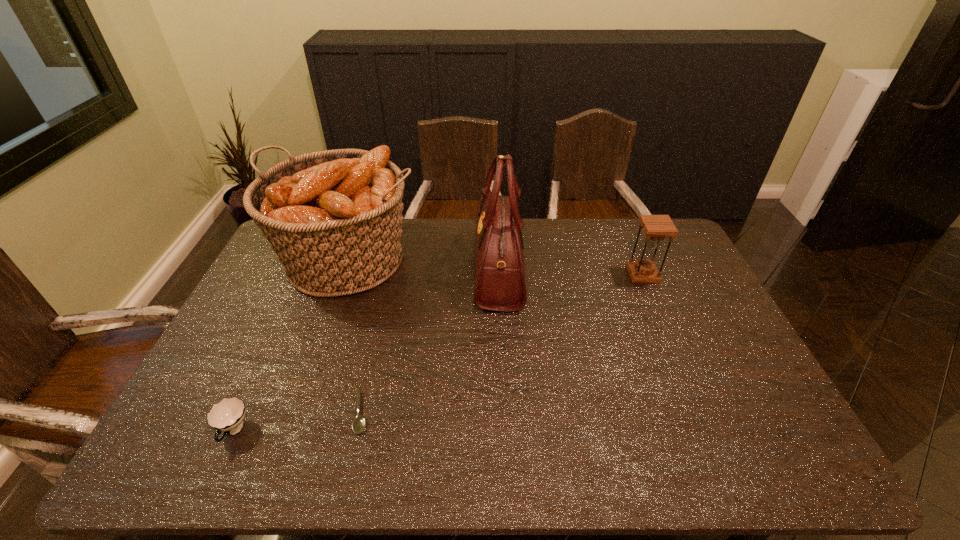
I want to click on free space located 0.330m on the front of the hourglass, so click(681, 363).

The width and height of the screenshot is (960, 540). In order to click on free region located 0.390m on the back of the soupspoon in this screenshot , I will do pos(389,289).

Find the location of a particular element. This screenshot has width=960, height=540. handbag that is at the far edge is located at coordinates (500, 285).

Identify the location of basket that is at the far edge. This screenshot has height=540, width=960. (334, 217).

Where is `object present at the near edge`? The height and width of the screenshot is (540, 960). object present at the near edge is located at coordinates (227, 416).

Find the location of a particular element. basket located in the left edge section of the desktop is located at coordinates point(334,217).

Identify the location of cup at the left edge. (227, 416).

Image resolution: width=960 pixels, height=540 pixels. Identify the location of object that is at the right edge. (656, 227).

This screenshot has height=540, width=960. I want to click on object positioned at the far left corner, so click(x=334, y=217).

Locate an element on the screen. This screenshot has height=540, width=960. object present at the near left corner is located at coordinates (227, 416).